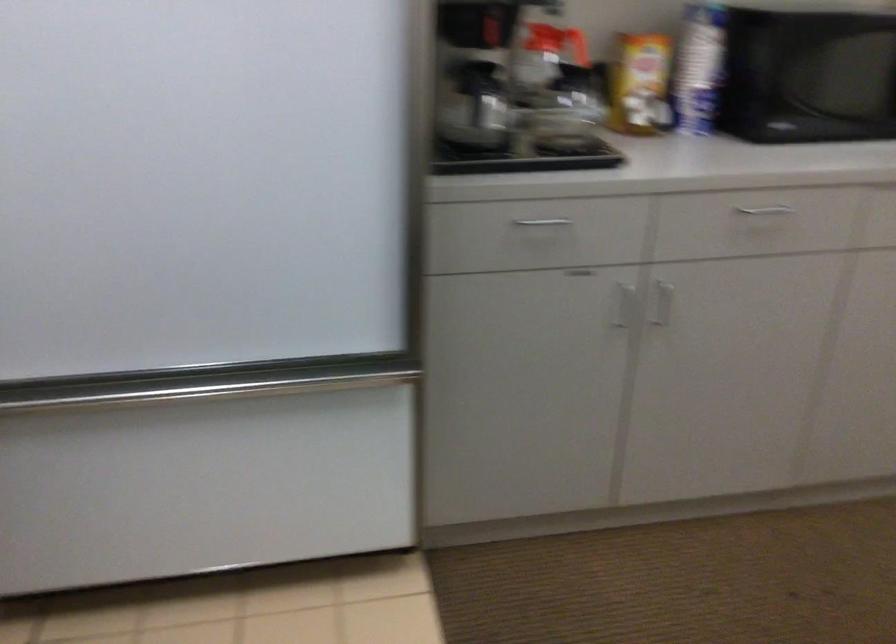
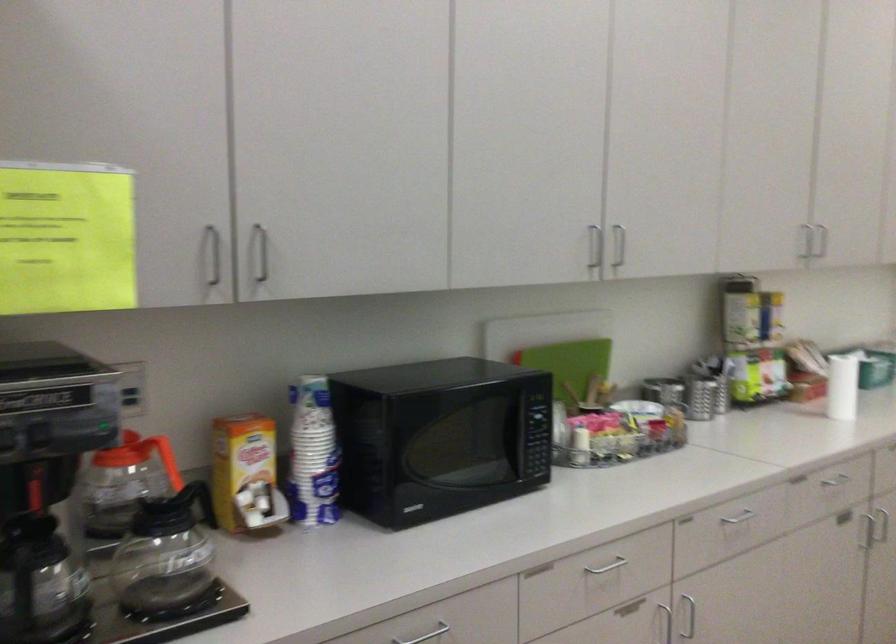
First-person continuous shooting, in which direction is the camera rotating?

The camera's rotation is toward right-up.